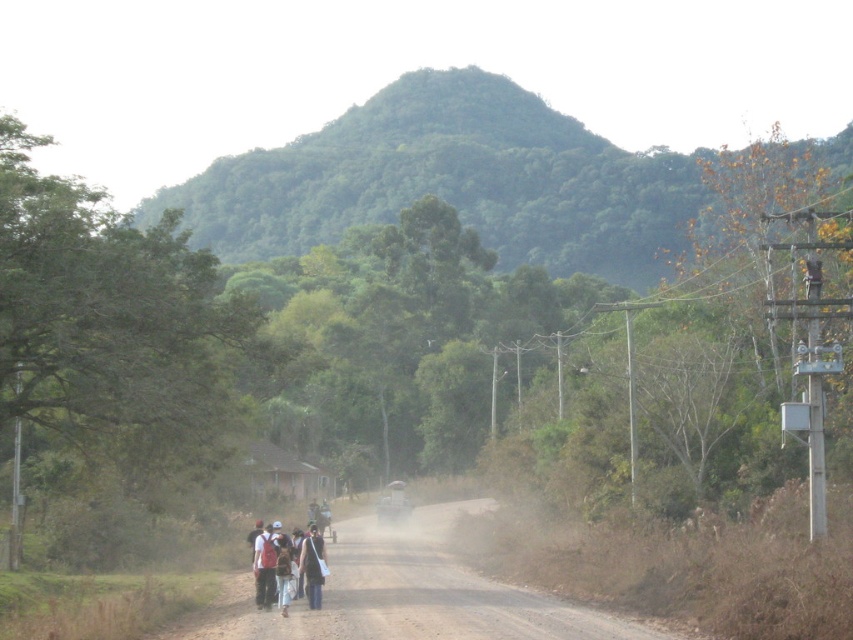
Based on the photo, you are a photographer positioned at the center of the dirt road. You want to capture both the white cotton shirt at center and the metallic silver motorcycle at center in your shot. Which object should you adjust your camera to focus on first to ensure it appears on the right side of the photo?

You should focus on the white cotton shirt at center first because it is positioned to the right of the metallic silver motorcycle at center, so adjusting the camera to include it on the right side will naturally place the metallic silver motorcycle at center on the left.